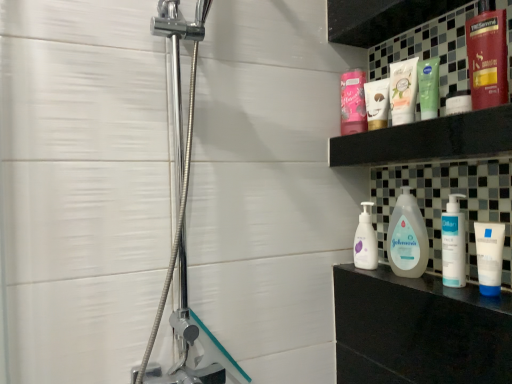
Question: From the image's perspective, is white pump bottle at right, the 4th toiletry in the back-to-front sequence, located above green matte lotion at upper center, the 3th toiletry when ordered from back to front?

Choices:
 (A) no
 (B) yes

Answer: (A)

Question: Is white pump bottle at right, which is counted as the third toiletry, starting from the front, aimed at green matte lotion at upper center, the 4th toiletry viewed from the front?

Choices:
 (A) no
 (B) yes

Answer: (A)

Question: From a real-world perspective, is white pump bottle at right, the 4th toiletry in the back-to-front sequence, below green matte lotion at upper center, the 3th toiletry when ordered from back to front?

Choices:
 (A) no
 (B) yes

Answer: (B)

Question: Is white pump bottle at right, which is counted as the third toiletry, starting from the front, looking in the opposite direction of green matte lotion at upper center, the 3th toiletry when ordered from back to front?

Choices:
 (A) no
 (B) yes

Answer: (A)

Question: Does white pump bottle at right, which is counted as the third toiletry, starting from the front, have a greater height compared to green matte lotion at upper center, the 3th toiletry when ordered from back to front?

Choices:
 (A) no
 (B) yes

Answer: (B)

Question: Considering the positions of pink matte jar at upper center, which is the first toiletry in back-to-front order, and matte plastic bottles at upper right in the image, is pink matte jar at upper center, which is the first toiletry in back-to-front order, wider or thinner than matte plastic bottles at upper right?

Choices:
 (A) thin
 (B) wide

Answer: (A)

Question: From the image's perspective, is pink matte jar at upper center, the 6th toiletry positioned from the front, located above or below matte plastic bottles at upper right?

Choices:
 (A) below
 (B) above

Answer: (B)

Question: In terms of height, does pink matte jar at upper center, which is the first toiletry in back-to-front order, look taller or shorter compared to matte plastic bottles at upper right?

Choices:
 (A) tall
 (B) short

Answer: (A)

Question: Which is correct: pink matte jar at upper center, which is the first toiletry in back-to-front order, is inside matte plastic bottles at upper right, or outside of it?

Choices:
 (A) inside
 (B) outside

Answer: (B)

Question: Is point (489, 11) closer or farther from the camera than point (495, 243)?

Choices:
 (A) closer
 (B) farther

Answer: (A)

Question: From a real-world perspective, is shiny red hair conditioner at upper right, which is counted as the 6th toiletry, starting from the back, physically located above or below white matte tube at right, arranged as the fifth toiletry when viewed from the back?

Choices:
 (A) above
 (B) below

Answer: (A)

Question: Is shiny red hair conditioner at upper right, which is counted as the 6th toiletry, starting from the back, taller or shorter than white matte tube at right, marked as the second toiletry in a front-to-back arrangement?

Choices:
 (A) short
 (B) tall

Answer: (B)

Question: From the image's perspective, is shiny red hair conditioner at upper right, which is counted as the 6th toiletry, starting from the back, located above or below white matte tube at right, marked as the second toiletry in a front-to-back arrangement?

Choices:
 (A) below
 (B) above

Answer: (B)

Question: From the image's perspective, is white matte pump bottle at right, which appears as the second cleaning product when viewed from the front, located above or below green matte lotion at upper center, the 4th toiletry viewed from the front?

Choices:
 (A) above
 (B) below

Answer: (B)

Question: In the image, is white matte pump bottle at right, positioned as the 1th cleaning product in back-to-front order, on the left side or the right side of green matte lotion at upper center, the 4th toiletry viewed from the front?

Choices:
 (A) right
 (B) left

Answer: (B)